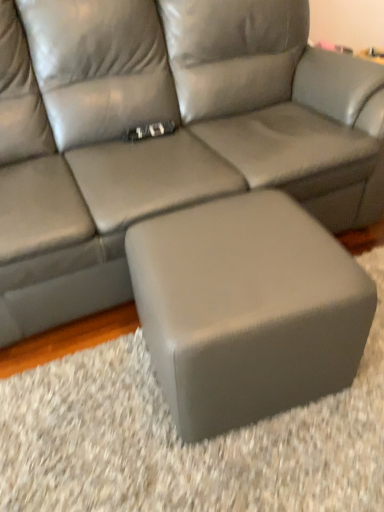
Question: Is matte gray leather couch at center taller or shorter than matte gray ottoman at center?

Choices:
 (A) tall
 (B) short

Answer: (A)

Question: In terms of width, does matte gray leather couch at center look wider or thinner when compared to matte gray ottoman at center?

Choices:
 (A) wide
 (B) thin

Answer: (A)

Question: From the image's perspective, is matte gray leather couch at center above or below matte gray ottoman at center?

Choices:
 (A) above
 (B) below

Answer: (A)

Question: In terms of size, does matte gray ottoman at center appear bigger or smaller than matte gray leather couch at center?

Choices:
 (A) small
 (B) big

Answer: (A)

Question: Considering the positions of matte gray ottoman at center and matte gray leather couch at center in the image, is matte gray ottoman at center taller or shorter than matte gray leather couch at center?

Choices:
 (A) short
 (B) tall

Answer: (A)

Question: Considering the positions of matte gray ottoman at center and matte gray leather couch at center in the image, is matte gray ottoman at center wider or thinner than matte gray leather couch at center?

Choices:
 (A) wide
 (B) thin

Answer: (B)

Question: From a real-world perspective, is matte gray ottoman at center above or below matte gray leather couch at center?

Choices:
 (A) above
 (B) below

Answer: (B)